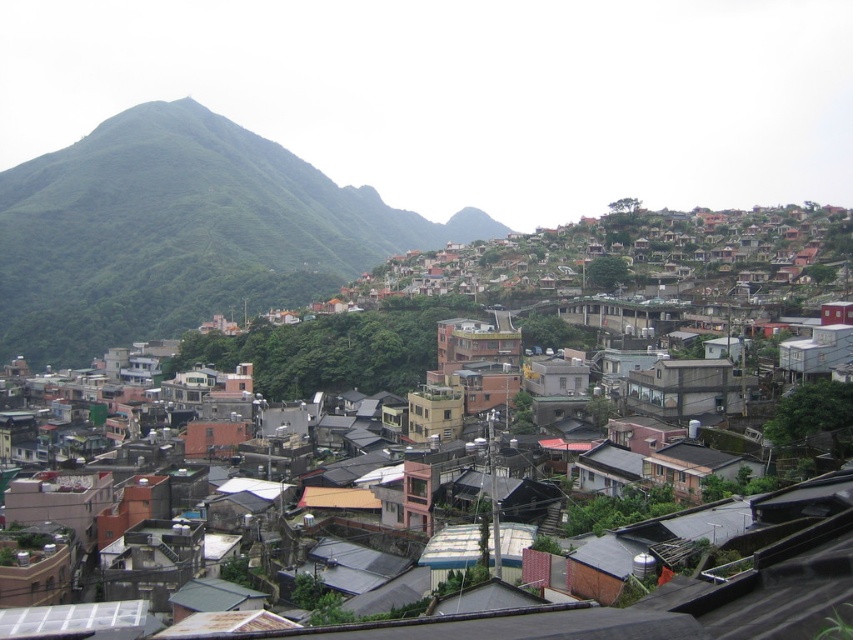
Based on the photo, between green leafy mountain at upper left and matte gray buildings at center, which one has less height?

With less height is matte gray buildings at center.

Is point (10, 252) behind point (817, 406)?

Yes, point (10, 252) is farther from viewer.

From the picture: Measure the distance between green leafy mountain at upper left and camera.

green leafy mountain at upper left and camera are 414.80 meters apart from each other.

This screenshot has height=640, width=853. I want to click on green leafy mountain at upper left, so click(x=181, y=232).